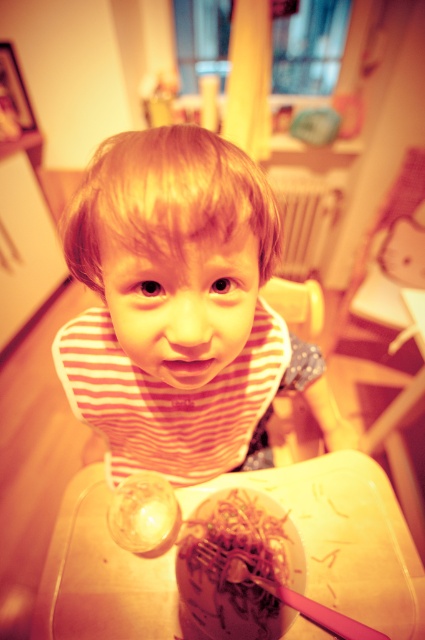
You are a parent trying to place the pink plastic chopstick at lower center on the translucent plastic tray at center. Can the chopstick fit vertically on the tray?

The translucent plastic tray at center has a greater height compared to pink plastic chopstick at lower center, so yes, the chopstick can fit vertically on the tray.

You are a parent trying to decide whether to use the pink plastic chopstick at lower center to eat the shiny brown noodles at lower center. Considering their sizes, will the chopstick be long enough to reach the bottom of the noodles?

The shiny brown noodles at lower center is much taller than the pink plastic chopstick at lower center, so the chopstick may not be long enough to reach the bottom of the noodles.

You are a photographer setting up for a photo shoot. You need to position the camera so that it is exactly 70 centimeters away from the translucent plastic tray at center to capture the perfect shot. Is the current camera position correct?

The camera is currently 71.07 centimeters away from the translucent plastic tray at center, which is slightly more than 70 centimeters. Therefore, the camera needs to be moved closer by approximately 1.07 centimeters to achieve the desired distance.